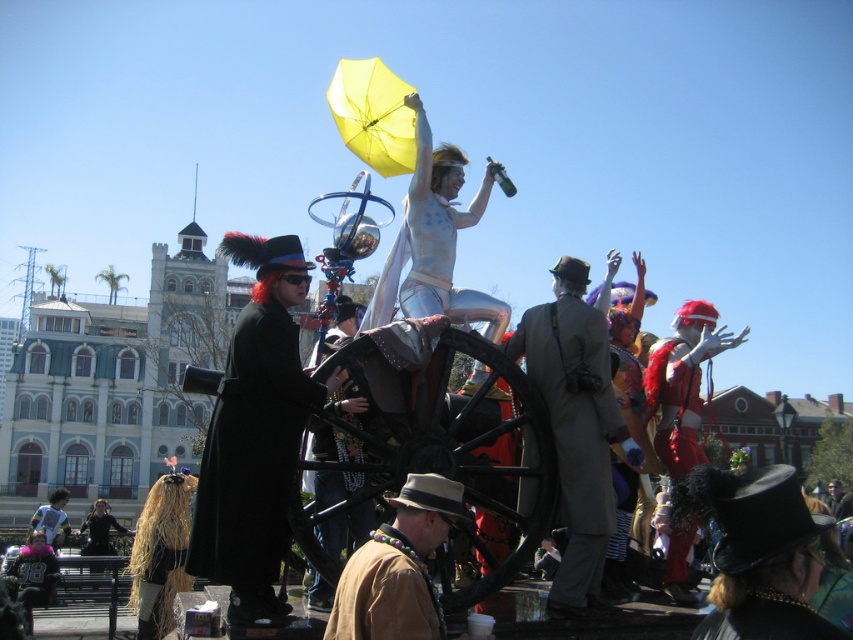
You are a photographer at the festival and want to capture both the black matte coat at left and the gray wool coat at center in a single frame. Based on their positions, which coat should you focus on first to ensure both are in the shot?

The black matte coat at left is below the gray wool coat at center, so you should focus on the gray wool coat at center first to ensure both are in the shot.

You are standing at the origin point in the image. Which of the two points, point (598,321) or point (360,636), is farther away from you?

Point (598,321) is farther away from you because it is behind point (360,636).